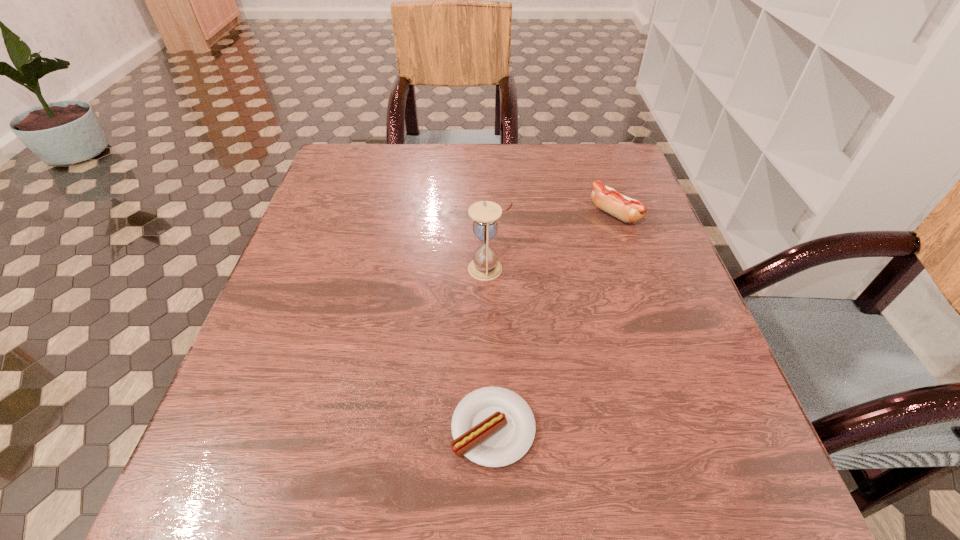
You are a GUI agent. You are given a task and a screenshot of the screen. Output one action in this format:
    pyautogui.click(x=<x>, y=<y>)
    Task: Click on the free space between the nearer sausage and the second tallest object
    This screenshot has height=540, width=960.
    Given the screenshot: What is the action you would take?
    pyautogui.click(x=554, y=321)

Find the location of a particular element. This screenshot has height=540, width=960. empty location between the rightmost object and the shorter sausage is located at coordinates (554, 321).

At what (x,y) coordinates should I click in order to perform the action: click on free spot between the tallest object and the farthest object. Please return your answer as a coordinate pair (x, y). The height and width of the screenshot is (540, 960). Looking at the image, I should click on (552, 241).

This screenshot has width=960, height=540. I want to click on unoccupied position between the taller sausage and the second farthest object, so pyautogui.click(x=552, y=241).

I want to click on empty space between the taller sausage and the second nearest object, so click(x=552, y=241).

The width and height of the screenshot is (960, 540). I want to click on free space between the nearest object and the hourglass, so tap(491, 348).

Find the location of a particular element. free space between the shortest object and the second nearest object is located at coordinates (491, 348).

Identify the location of vacant space that's between the nearer sausage and the second tallest object. (554, 321).

Locate an element on the screen. The width and height of the screenshot is (960, 540). the closest object relative to the hourglass is located at coordinates (628, 210).

At what (x,y) coordinates should I click in order to perform the action: click on object that ranks as the second closest to the nearest object. Please return your answer as a coordinate pair (x, y). Image resolution: width=960 pixels, height=540 pixels. Looking at the image, I should click on (628, 210).